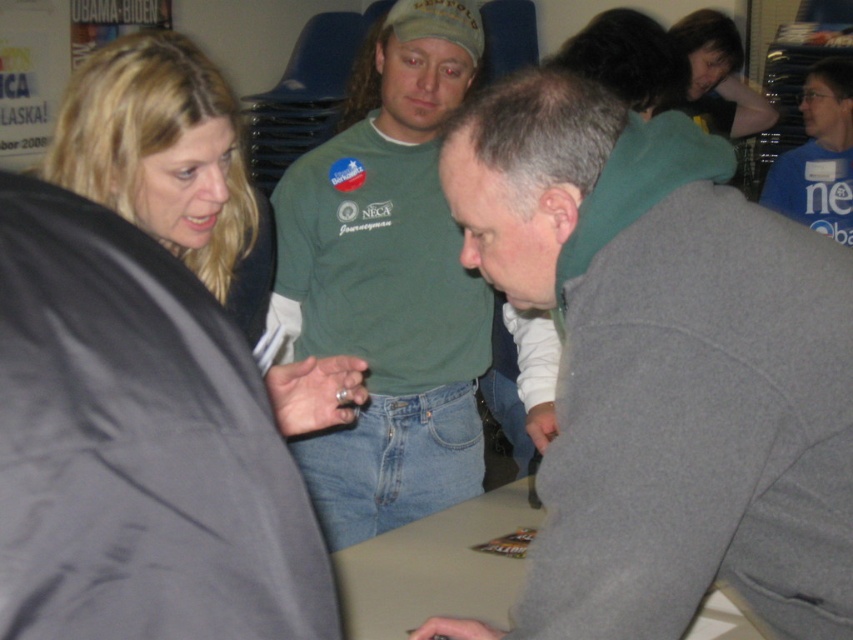
Question: Which of the following is the farthest from the observer?

Choices:
 (A) beige matte table at center
 (B) blonde hair at upper left

Answer: (A)

Question: Which is nearer to the gray fleece jacket at center?

Choices:
 (A) blue cotton shirt at upper right
 (B) green cotton shirt at center
 (C) blonde hair at upper left

Answer: (C)

Question: Does blonde hair at upper left have a lesser width compared to beige matte table at center?

Choices:
 (A) no
 (B) yes

Answer: (A)

Question: Where is blonde hair at upper left located in relation to green cotton shirt at center in the image?

Choices:
 (A) right
 (B) left

Answer: (B)

Question: Is blonde hair at upper left in front of green cotton shirt at center?

Choices:
 (A) yes
 (B) no

Answer: (A)

Question: Which of the following is the farthest from the observer?

Choices:
 (A) beige matte table at center
 (B) gray fleece jacket at center
 (C) blue cotton shirt at upper right
 (D) green cotton shirt at center

Answer: (C)